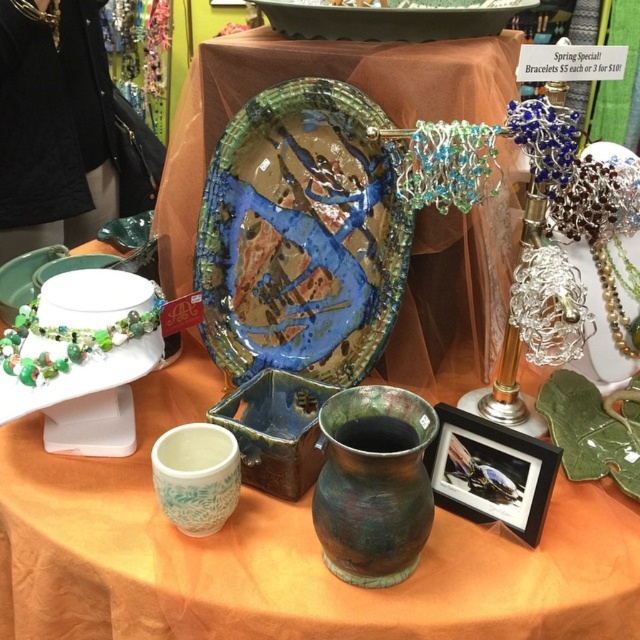
You are a customer at the craft fair looking to buy a gift. You see the rustic ceramic vase at center and the green matte plate at center. Which item is taller?

The rustic ceramic vase at center is much taller than the green matte plate at center.

You are standing at the market and want to move from the point at coordinates point [38,442] to the point at coordinates point [42,275]. Which direction should you move to get closer to the second point?

Since point [38,442] is in front of point [42,275], you should move backward to reach the second point.